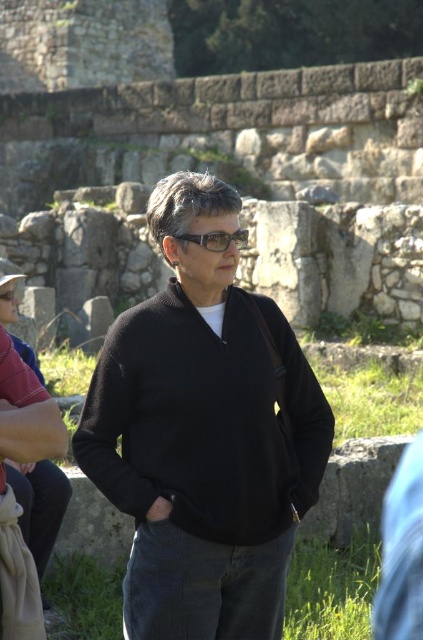
Question: Can you confirm if black knitted sweater at center is smaller than transparent plastic glasses at center?

Choices:
 (A) no
 (B) yes

Answer: (A)

Question: Which of the following is the farthest from the observer?

Choices:
 (A) transparent plastic glasses at center
 (B) black knitted sweater at center

Answer: (A)

Question: Which object appears closest to the camera in this image?

Choices:
 (A) transparent plastic glasses at center
 (B) black knitted sweater at center

Answer: (B)

Question: Which point is closer to the camera?

Choices:
 (A) transparent plastic glasses at center
 (B) black knitted sweater at center

Answer: (B)

Question: Can you confirm if black knitted sweater at center is positioned below transparent plastic glasses at center?

Choices:
 (A) yes
 (B) no

Answer: (A)

Question: Does black knitted sweater at center appear over transparent plastic glasses at center?

Choices:
 (A) no
 (B) yes

Answer: (A)